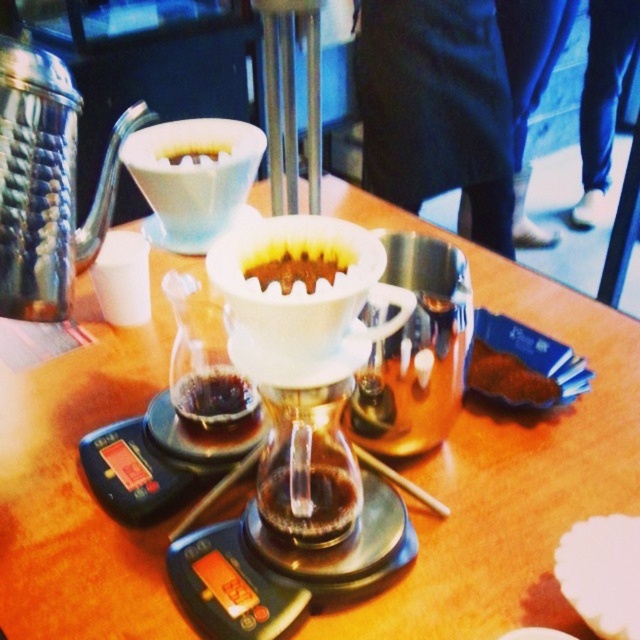
You are a barista preparing coffee and need to pour hot water into the white paper filter at center. Based on the setup shown, where should you direct the water to ensure it flows into the transparent glass carafe at center?

The transparent glass carafe at center is located below the white paper filter at center, so you should pour the water into the white paper filter at center and it will flow down into the carafe.

You are preparing coffee and have two filters in front of you on the table. One is a white matte coffee filter at center and the other is a white paper filter at center. Which one is taller?

The white matte coffee filter at center is much taller than the white paper filter at center.